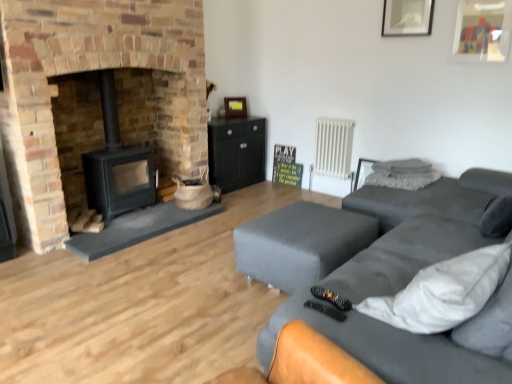
Question: From a real-world perspective, is matte gray fabric couch at right beneath wooden picture frame at upper center, the first picture frame positioned from the back?

Choices:
 (A) no
 (B) yes

Answer: (B)

Question: Is matte gray fabric couch at right positioned behind wooden picture frame at upper center, the first picture frame positioned from the back?

Choices:
 (A) no
 (B) yes

Answer: (A)

Question: Does matte gray fabric couch at right turn towards wooden picture frame at upper center, which ranks as the second picture frame in top-to-bottom order?

Choices:
 (A) no
 (B) yes

Answer: (B)

Question: From the image's perspective, does matte gray fabric couch at right appear lower than wooden picture frame at upper center, which ranks as the 2th picture frame in right-to-left order?

Choices:
 (A) no
 (B) yes

Answer: (B)

Question: Does matte gray fabric couch at right contain wooden picture frame at upper center, positioned as the second picture frame in front-to-back order?

Choices:
 (A) yes
 (B) no

Answer: (B)

Question: Does matte gray fabric couch at right have a greater height compared to wooden picture frame at upper center, which ranks as the second picture frame in top-to-bottom order?

Choices:
 (A) no
 (B) yes

Answer: (B)

Question: Would you say matte gray ottoman at lower right is part of white metallic radiator at upper right's contents?

Choices:
 (A) no
 (B) yes

Answer: (A)

Question: From the image's perspective, is white metallic radiator at upper right over matte gray ottoman at lower right?

Choices:
 (A) yes
 (B) no

Answer: (A)

Question: Considering the relative positions of white metallic radiator at upper right and matte gray ottoman at lower right in the image provided, is white metallic radiator at upper right behind matte gray ottoman at lower right?

Choices:
 (A) no
 (B) yes

Answer: (B)

Question: Can you confirm if white metallic radiator at upper right is bigger than matte gray ottoman at lower right?

Choices:
 (A) no
 (B) yes

Answer: (A)

Question: Is the surface of white metallic radiator at upper right in direct contact with matte gray ottoman at lower right?

Choices:
 (A) no
 (B) yes

Answer: (A)

Question: Considering the relative sizes of white metallic radiator at upper right and matte gray ottoman at lower right in the image provided, is white metallic radiator at upper right smaller than matte gray ottoman at lower right?

Choices:
 (A) no
 (B) yes

Answer: (B)

Question: From the image's perspective, is black matte wood burning stove at left below white textured pillow at upper right, the 2th pillow in the bottom-to-top sequence?

Choices:
 (A) yes
 (B) no

Answer: (B)